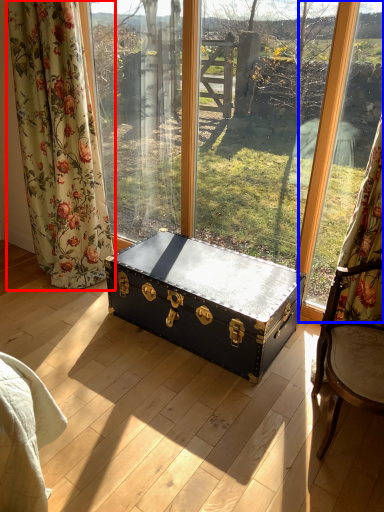
Question: Which point is closer to the camera, curtain (highlighted by a red box) or window frame (highlighted by a blue box)?

Choices:
 (A) curtain
 (B) window frame

Answer: (B)